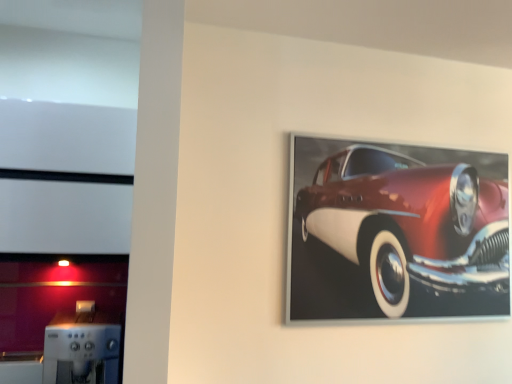
Question: From a real-world perspective, is shiny red car at upper right above or below sleek silver coffee machine at lower left?

Choices:
 (A) above
 (B) below

Answer: (A)

Question: Is shiny red car at upper right wider or thinner than sleek silver coffee machine at lower left?

Choices:
 (A) thin
 (B) wide

Answer: (A)

Question: Based on their positions, is shiny red car at upper right located to the left or right of sleek silver coffee machine at lower left?

Choices:
 (A) right
 (B) left

Answer: (A)

Question: From the image's perspective, relative to shiny red car at upper right, is sleek silver coffee machine at lower left above or below?

Choices:
 (A) below
 (B) above

Answer: (A)

Question: In the image, is sleek silver coffee machine at lower left positioned in front of or behind shiny red car at upper right?

Choices:
 (A) front
 (B) behind

Answer: (A)

Question: Is sleek silver coffee machine at lower left wider or thinner than shiny red car at upper right?

Choices:
 (A) wide
 (B) thin

Answer: (A)

Question: From a real-world perspective, is sleek silver coffee machine at lower left above or below shiny red car at upper right?

Choices:
 (A) above
 (B) below

Answer: (B)